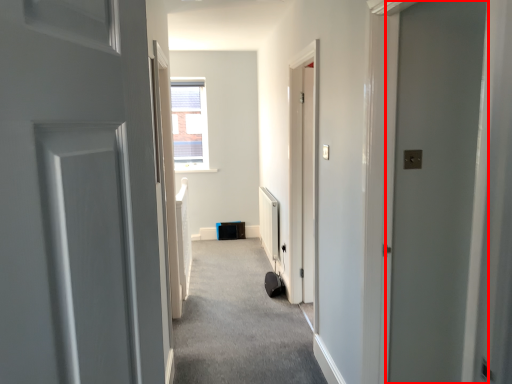
Question: Where is door (annotated by the red box) located in relation to corridor in the image?

Choices:
 (A) left
 (B) right

Answer: (B)